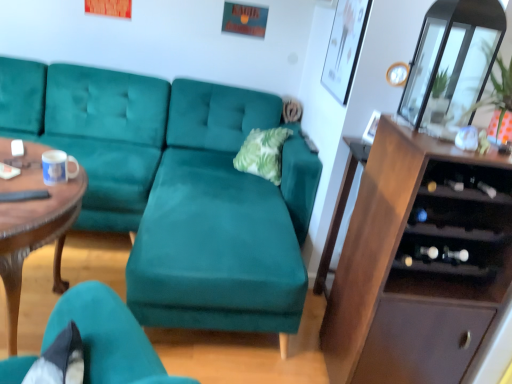
Question: From a real-world perspective, is teal velvet couch at center over white glossy mug at center?

Choices:
 (A) yes
 (B) no

Answer: (B)

Question: Could you tell me if teal velvet couch at center is turned towards white glossy mug at center?

Choices:
 (A) no
 (B) yes

Answer: (B)

Question: Is teal velvet couch at center completely or partially outside of white glossy mug at center?

Choices:
 (A) no
 (B) yes

Answer: (B)

Question: Are teal velvet couch at center and white glossy mug at center located far from each other?

Choices:
 (A) no
 (B) yes

Answer: (A)

Question: From the image's perspective, is teal velvet couch at center below white glossy mug at center?

Choices:
 (A) no
 (B) yes

Answer: (B)

Question: From the image's perspective, relative to transparent glass door at upper right, is white glossy mug at center above or below?

Choices:
 (A) below
 (B) above

Answer: (A)

Question: Looking at the image, does white glossy mug at center seem bigger or smaller compared to transparent glass door at upper right?

Choices:
 (A) small
 (B) big

Answer: (A)

Question: Considering the relative positions of white glossy mug at center and transparent glass door at upper right in the image provided, is white glossy mug at center to the left or to the right of transparent glass door at upper right?

Choices:
 (A) left
 (B) right

Answer: (A)

Question: Relative to transparent glass door at upper right, is white glossy mug at center in front or behind?

Choices:
 (A) front
 (B) behind

Answer: (B)

Question: Is teal velvet couch at center spatially inside brown wood cabinet at right, or outside of it?

Choices:
 (A) outside
 (B) inside

Answer: (A)

Question: Would you say teal velvet couch at center is to the left or to the right of brown wood cabinet at right in the picture?

Choices:
 (A) left
 (B) right

Answer: (A)

Question: Is point (267, 188) closer or farther from the camera than point (457, 271)?

Choices:
 (A) farther
 (B) closer

Answer: (A)

Question: Relative to brown wood cabinet at right, is teal velvet couch at center in front or behind?

Choices:
 (A) front
 (B) behind

Answer: (B)

Question: Is transparent glass door at upper right taller or shorter than white glossy mug at center?

Choices:
 (A) short
 (B) tall

Answer: (B)

Question: Considering the positions of transparent glass door at upper right and white glossy mug at center in the image, is transparent glass door at upper right bigger or smaller than white glossy mug at center?

Choices:
 (A) big
 (B) small

Answer: (A)